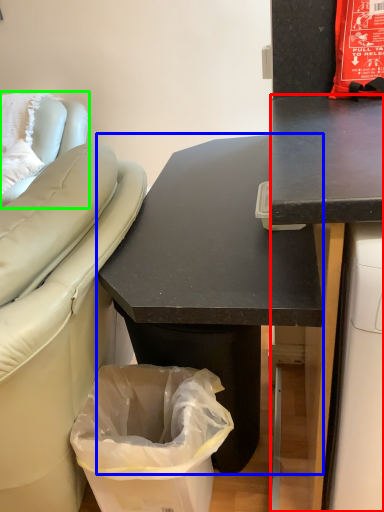
Question: Which is farther away from desk (highlighted by a red box)? desk (highlighted by a blue box) or furniture (highlighted by a green box)?

Choices:
 (A) desk
 (B) furniture

Answer: (B)